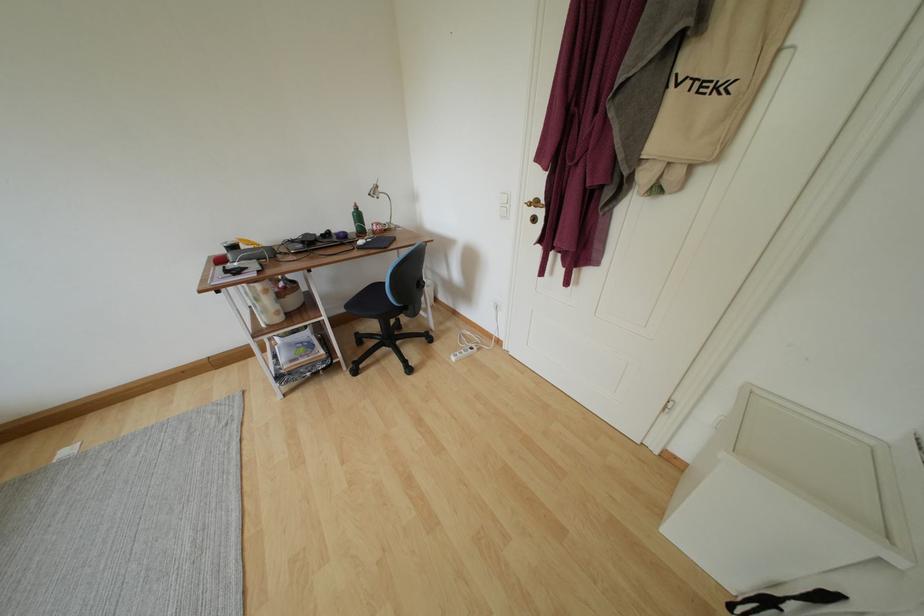
You are a GUI agent. You are given a task and a screenshot of the screen. Output one action in this format:
    pyautogui.click(x=<x>, y=<y>)
    Task: Click on the chair sitting surface
    
    Given the screenshot: What is the action you would take?
    click(x=369, y=299)